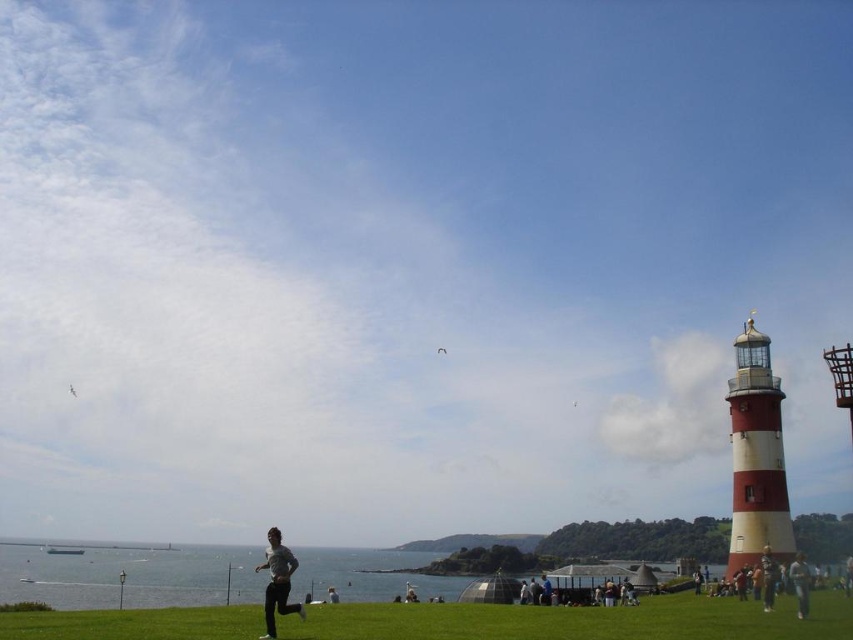
Question: In this image, where is light gray cotton shirt at lower right located relative to white cotton shirt at lower center?

Choices:
 (A) below
 (B) above

Answer: (B)

Question: Which point appears closest to the camera in this image?

Choices:
 (A) (764, 611)
 (B) (73, 387)
 (C) (675, 636)

Answer: (C)

Question: Which of these objects is positioned closest to the white paper kite at upper center?

Choices:
 (A) light blue denim jeans at lower right
 (B) green grass at lower center
 (C) blue water at lower center
 (D) light gray cotton shirt at lower right

Answer: (B)

Question: Which point is closer to the camera?

Choices:
 (A) (346, 560)
 (B) (802, 612)

Answer: (B)

Question: Is blue water at lower center positioned behind light blue denim jeans at lower right?

Choices:
 (A) yes
 (B) no

Answer: (A)

Question: Is gray cotton shirt at center further to camera compared to white matte kite at upper center?

Choices:
 (A) no
 (B) yes

Answer: (A)